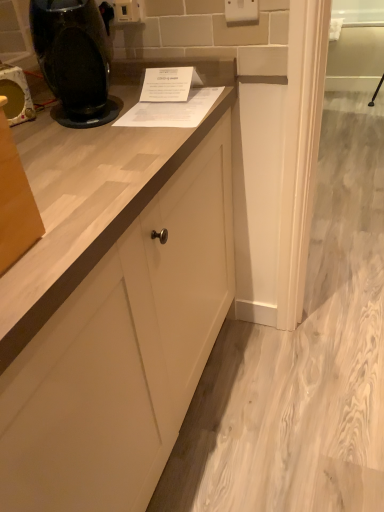
Question: Based on their sizes in the image, would you say white plastic electric outlet at upper center, which is the 2th electric outlet in right-to-left order, is bigger or smaller than white plastic electric outlet at upper center, which is counted as the 1th electric outlet, starting from the right?

Choices:
 (A) small
 (B) big

Answer: (B)

Question: Based on their positions, is white plastic electric outlet at upper center, which is the 2th electric outlet in right-to-left order, located to the left or right of white plastic electric outlet at upper center, the second electric outlet from the left?

Choices:
 (A) left
 (B) right

Answer: (A)

Question: Based on their relative distances, which object is farther from the matte black coffee machine at left?

Choices:
 (A) white plastic electric outlet at upper center, the second electric outlet from the left
 (B) black glossy coffee machine at upper left
 (C) white plastic electric outlet at upper center, which is the 2th electric outlet in right-to-left order

Answer: (A)

Question: Which of these objects is positioned farthest from the white plastic electric outlet at upper center, the second electric outlet from the left?

Choices:
 (A) white plastic electric outlet at upper center, acting as the 1th electric outlet starting from the back
 (B) matte black coffee machine at left
 (C) black glossy coffee machine at upper left

Answer: (B)